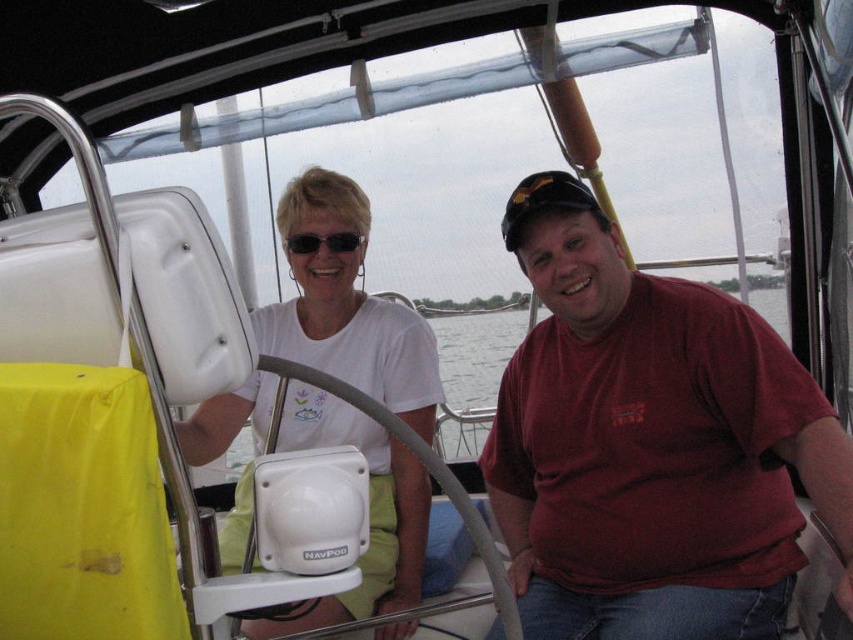
You are a passenger on the boat and want to reach the closest point to you between point (637, 346) and point (785, 301). Which point should you move towards?

Point (637, 346) is closer to the viewer than point (785, 301), so you should move towards point (637, 346).

You are designing a storage compartment for the boat cockpit. The compartment must fit either the red matte shirt at center or the matte black sunglasses at upper center. Which item requires a wider storage space?

The red matte shirt at center requires a wider storage space because its width is larger than that of the matte black sunglasses at upper center.